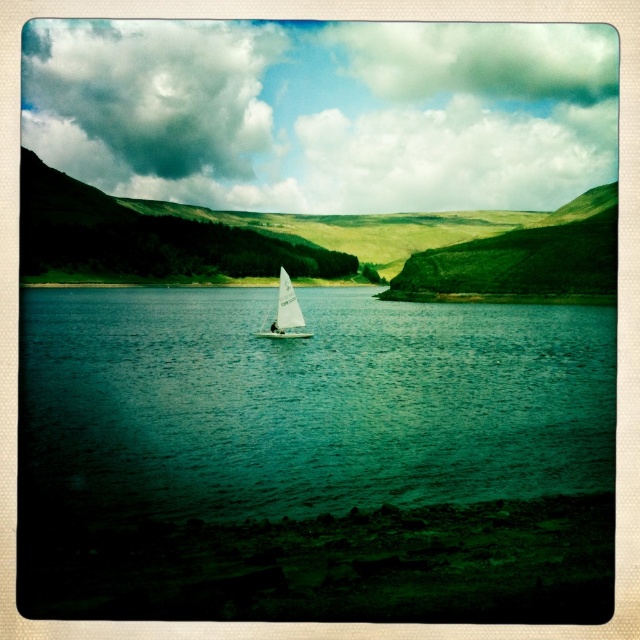
Question: Which object is closer to the camera taking this photo?

Choices:
 (A) white sailboat at center
 (B) green water at center

Answer: (B)

Question: Is green water at center below white sailboat at center?

Choices:
 (A) yes
 (B) no

Answer: (A)

Question: Where is green water at center located in relation to white sailboat at center in the image?

Choices:
 (A) right
 (B) left

Answer: (B)

Question: Observing the image, what is the correct spatial positioning of green water at center in reference to white sailboat at center?

Choices:
 (A) above
 (B) below

Answer: (B)